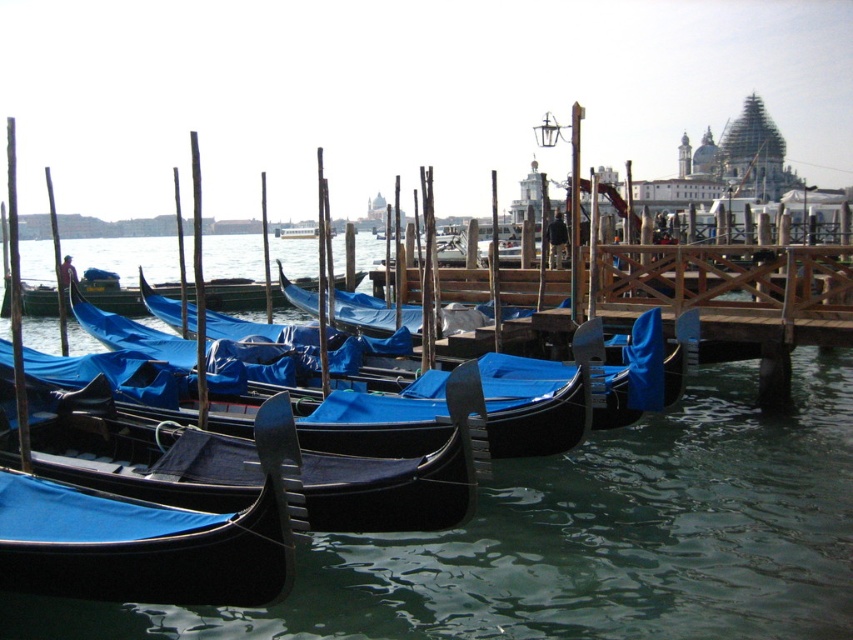
You are standing on the dock in Venice and see two points marked on the water. The first point is at coordinates point (71, 400) and the second is at point (80, 289). Which point is closer to you as you face the water?

Point (71, 400) is in front of point (80, 289), so it is closer to you as you face the water.

You are a tourist standing on the dock and want to take a photo of both the shiny black gondola at center and the blue glossy gondola at center. Which gondola should you move closer to in order to fit both into your camera frame?

Since the shiny black gondola at center is smaller than the blue glossy gondola at center, you should move closer to the shiny black gondola at center to ensure both gondolas are visible in the camera frame.

You are a tourist standing on the dock and want to take a photo of both the shiny black gondola at center and the blue glossy gondola at center. Which gondola should you position yourself to the left of to capture both in the frame?

You should position yourself to the left of the blue glossy gondola at center. Since the shiny black gondola at center is to the right of the blue glossy gondola at center, positioning yourself to the left of the blue glossy gondola at center will allow you to capture both gondolas in the frame.